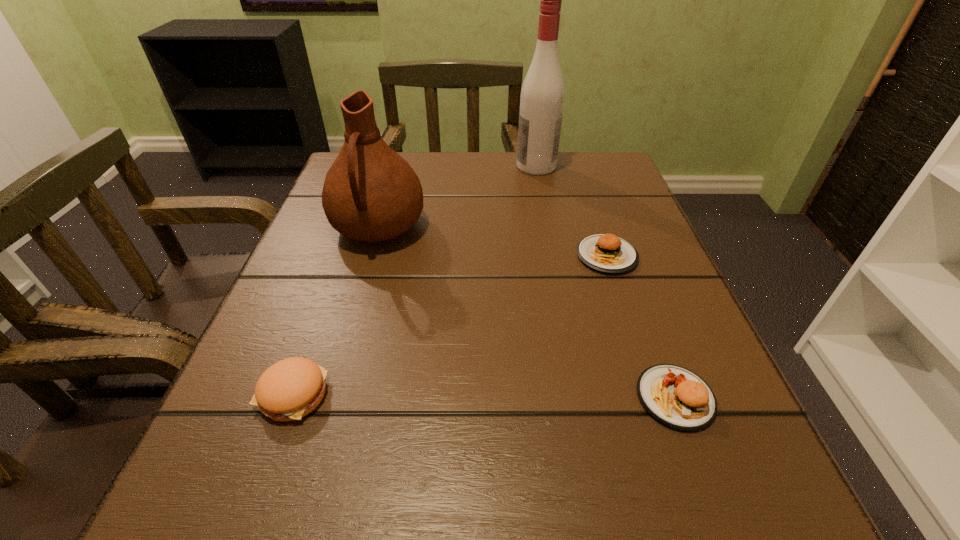
Identify the location of free space at the far edge. (453, 176).

Image resolution: width=960 pixels, height=540 pixels. What are the coordinates of `vacant space at the near edge of the desktop` in the screenshot? It's located at (332, 519).

Locate an element on the screen. vacant space at the left edge of the desktop is located at coordinates (354, 341).

The height and width of the screenshot is (540, 960). Identify the location of vacant space at the right edge of the desktop. (660, 282).

Image resolution: width=960 pixels, height=540 pixels. Identify the location of free space at the near left corner. (239, 494).

This screenshot has width=960, height=540. Find the location of `unoccupied position between the farthest food and the second tallest object`. unoccupied position between the farthest food and the second tallest object is located at coordinates (492, 242).

Identify the location of unoccupied position between the leftmost food and the farthest food. (450, 325).

The image size is (960, 540). In order to click on vacant area that lies between the leftmost food and the pitcher in this screenshot , I will do `click(336, 311)`.

Identify the location of free space between the tallest object and the farthest food. (571, 211).

Image resolution: width=960 pixels, height=540 pixels. I want to click on vacant space that's between the alcohol and the pitcher, so click(457, 197).